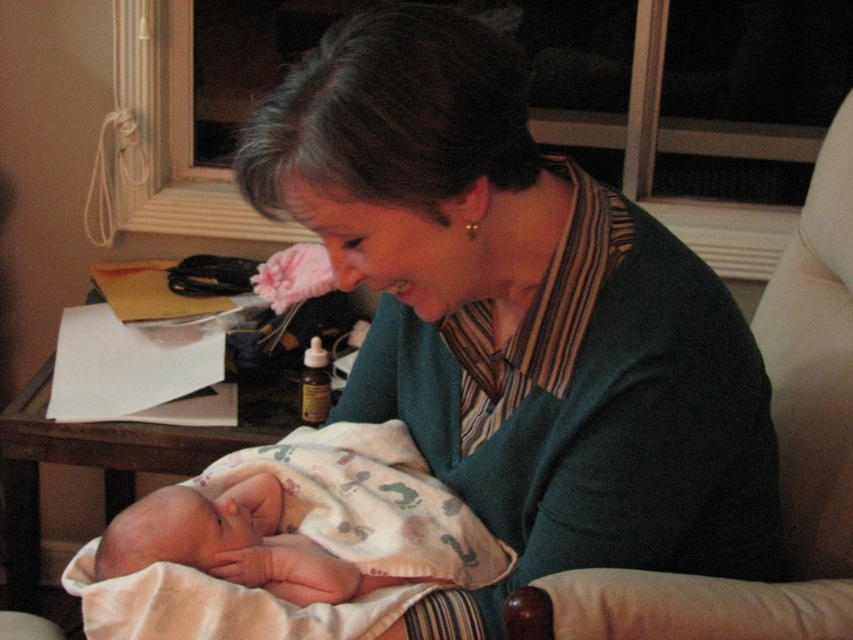
Question: From the image, what is the correct spatial relationship of matte green sweater at center in relation to white fabric armchair at right?

Choices:
 (A) right
 (B) left

Answer: (B)

Question: Among these points, which one is farthest from the camera?

Choices:
 (A) (677, 260)
 (B) (844, 376)

Answer: (B)

Question: Can you confirm if matte green sweater at center is thinner than white fabric armchair at right?

Choices:
 (A) no
 (B) yes

Answer: (A)

Question: Observing the image, what is the correct spatial positioning of white fabric armchair at right in reference to soft pink blanket at center?

Choices:
 (A) below
 (B) above

Answer: (B)

Question: Which point appears farthest from the camera in this image?

Choices:
 (A) pos(798,273)
 (B) pos(578,230)

Answer: (A)

Question: Which point appears closest to the camera in this image?

Choices:
 (A) (582, 211)
 (B) (840, 300)

Answer: (A)